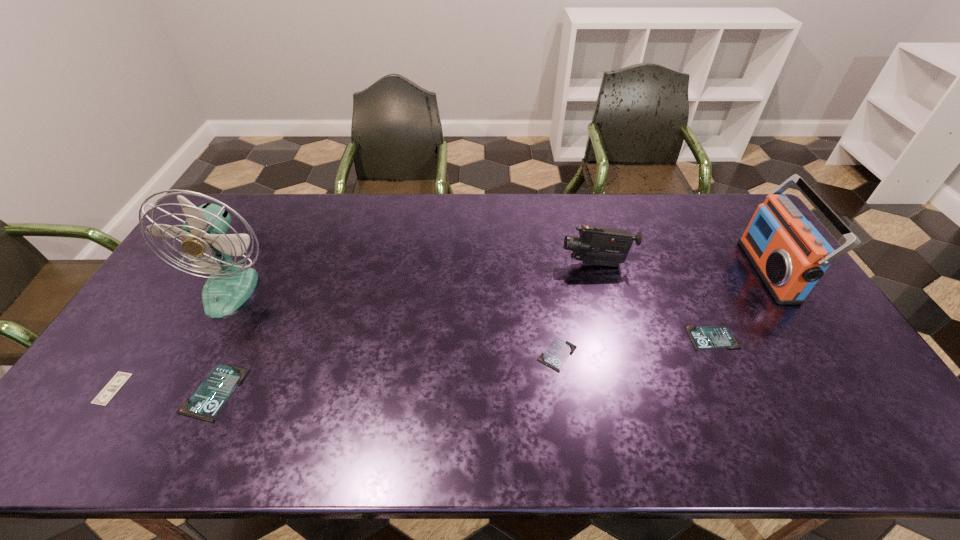
At what (x,y) coordinates should I click in order to perform the action: click on empty location between the rightmost object and the shortest object. Please return your answer as a coordinate pair (x, y). The height and width of the screenshot is (540, 960). Looking at the image, I should click on (441, 330).

The image size is (960, 540). In order to click on empty space that is in between the fourth tallest object and the camcorder in this screenshot , I will do `click(405, 328)`.

Identify the location of vacant area that lies between the rightmost object and the fifth shortest object. The height and width of the screenshot is (540, 960). (683, 268).

Where is `vacant area between the fourth shortest object and the camcorder`? This screenshot has width=960, height=540. vacant area between the fourth shortest object and the camcorder is located at coordinates (405, 328).

At what (x,y) coordinates should I click in order to perform the action: click on the fifth closest object to the radio receiver. Please return your answer as a coordinate pair (x, y). Looking at the image, I should click on (230, 284).

Locate which object ranks sixth in proximity to the shortest object. Please provide its 2D coordinates. Your answer should be formatted as a tuple, i.e. [(x, y)], where the tuple contains the x and y coordinates of a point satisfying the conditions above.

[(789, 254)]

You are a GUI agent. You are given a task and a screenshot of the screen. Output one action in this format:
    pyautogui.click(x=<x>, y=<y>)
    Task: Click on the identity card that stands as the second closest to the third shortest object
    
    Given the screenshot: What is the action you would take?
    pyautogui.click(x=210, y=396)

Where is `identity card that stands as the closest to the shortest object`? This screenshot has height=540, width=960. identity card that stands as the closest to the shortest object is located at coordinates (210, 396).

In order to click on free point that satisfies the following two spatial constraints: 1. in front of the second shortest object, directing airflow; 2. on the right side of the tallest object in this screenshot , I will do `click(196, 355)`.

This screenshot has width=960, height=540. Find the location of `free space that satisfies the following two spatial constraints: 1. on the front side of the fourth tallest object; 2. on the left side of the money`. free space that satisfies the following two spatial constraints: 1. on the front side of the fourth tallest object; 2. on the left side of the money is located at coordinates (109, 393).